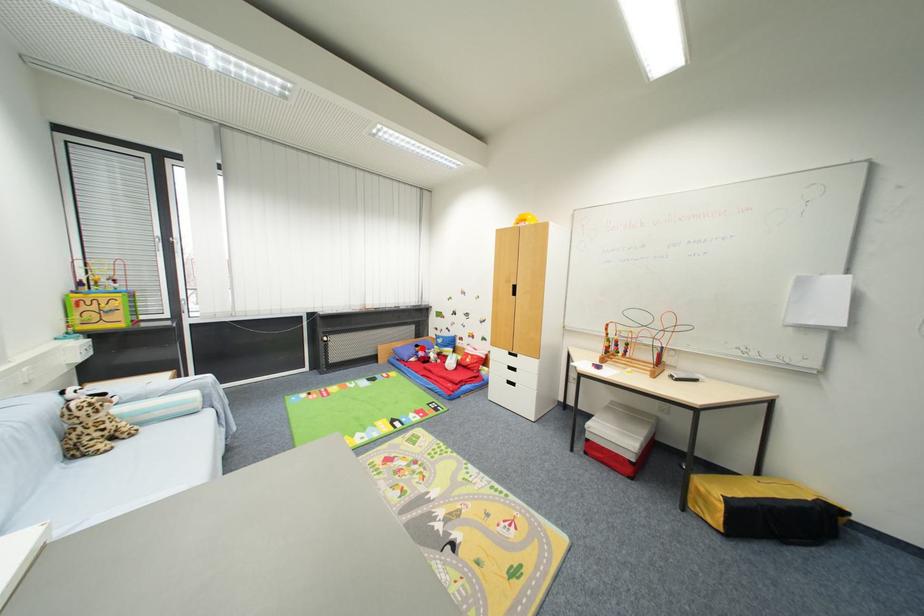
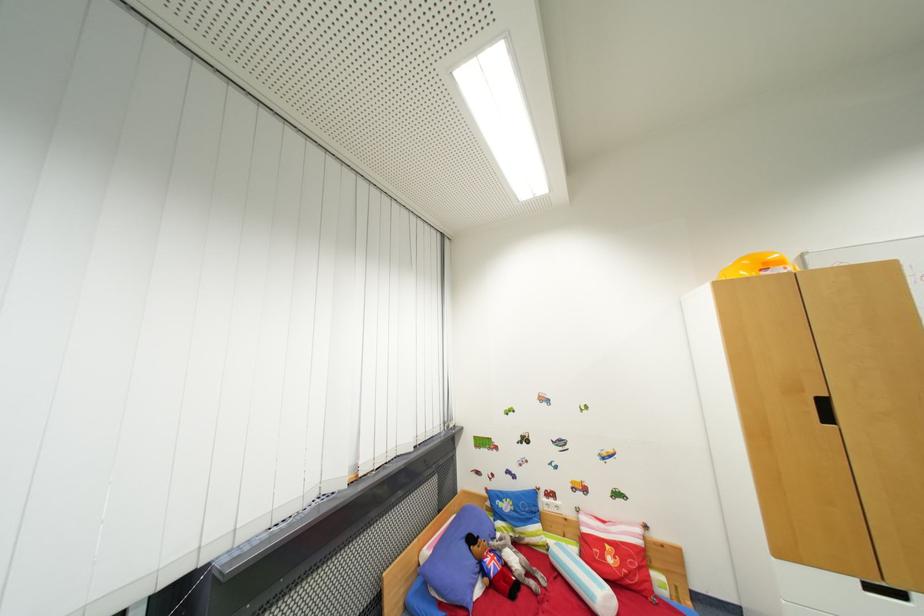
Question: A red point is marked in image1. In image2, is the corresponding 3D point closer to the camera or farther? Reply with the corresponding letter.

Choices:
 (A) The corresponding 3D point is closer.
 (B) The corresponding 3D point is farther.

Answer: (A)